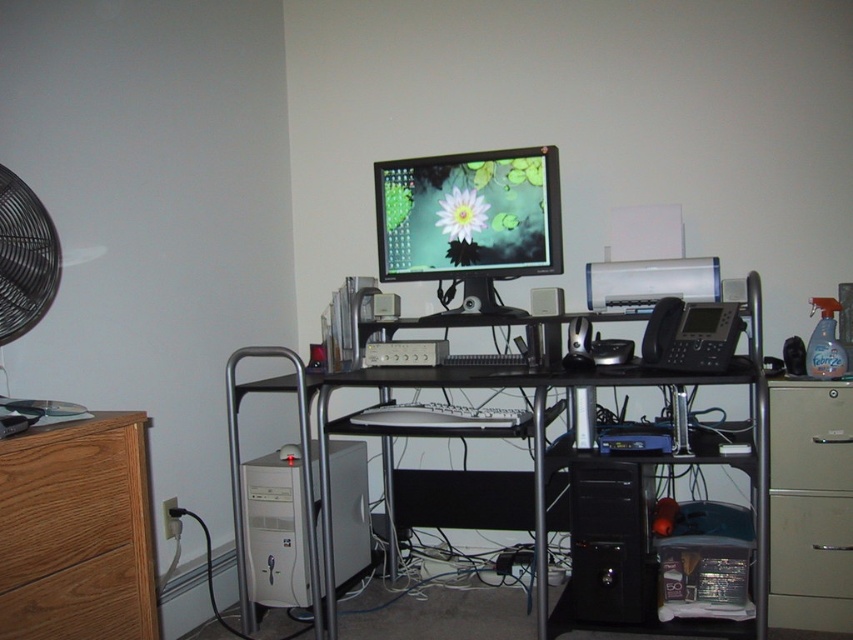
Question: Which object is the farthest from the brown wood/file cabinet at left?

Choices:
 (A) black plastic speaker at center
 (B) brushed metal fan at left

Answer: (A)

Question: Can you confirm if white plastic computer tower at lower left is positioned above metallic gray drawer at lower right?

Choices:
 (A) yes
 (B) no

Answer: (A)

Question: Does brown wood/file cabinet at left have a smaller size compared to black metal computer desk at center?

Choices:
 (A) yes
 (B) no

Answer: (A)

Question: Is brushed metal fan at left closer to the viewer compared to metallic gray drawer at lower right?

Choices:
 (A) no
 (B) yes

Answer: (B)

Question: Estimate the real-world distances between objects in this image. Which object is closer to the beige matte drawer at lower right?

Choices:
 (A) black metal computer desk at center
 (B) black plastic speaker at center
 (C) brushed metal fan at left
 (D) wooden drawer at lower left

Answer: (A)

Question: Which of the following is the farthest from the observer?

Choices:
 (A) click(0, 342)
 (B) click(320, 448)
 (C) click(554, 310)

Answer: (C)